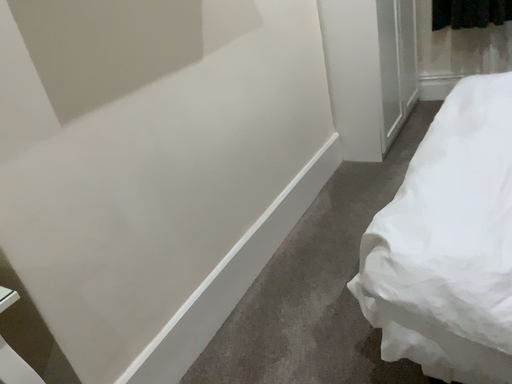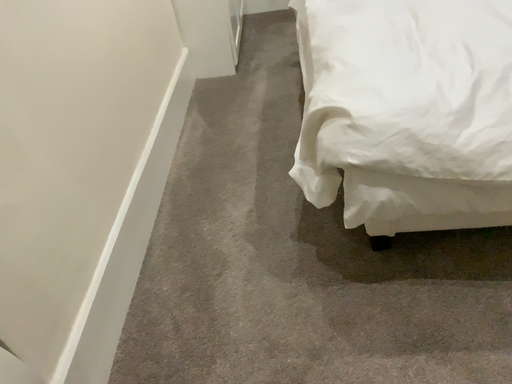
Question: Which way did the camera rotate in the video?

Choices:
 (A) rotated right
 (B) rotated left

Answer: (A)